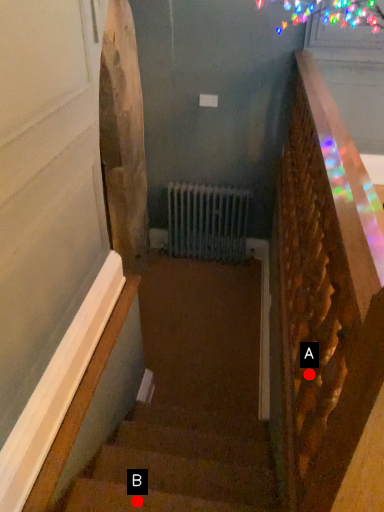
Question: Two points are circled on the image, labeled by A and B beside each circle. Which point is closer to the camera taking this photo?

Choices:
 (A) A is closer
 (B) B is closer

Answer: (A)